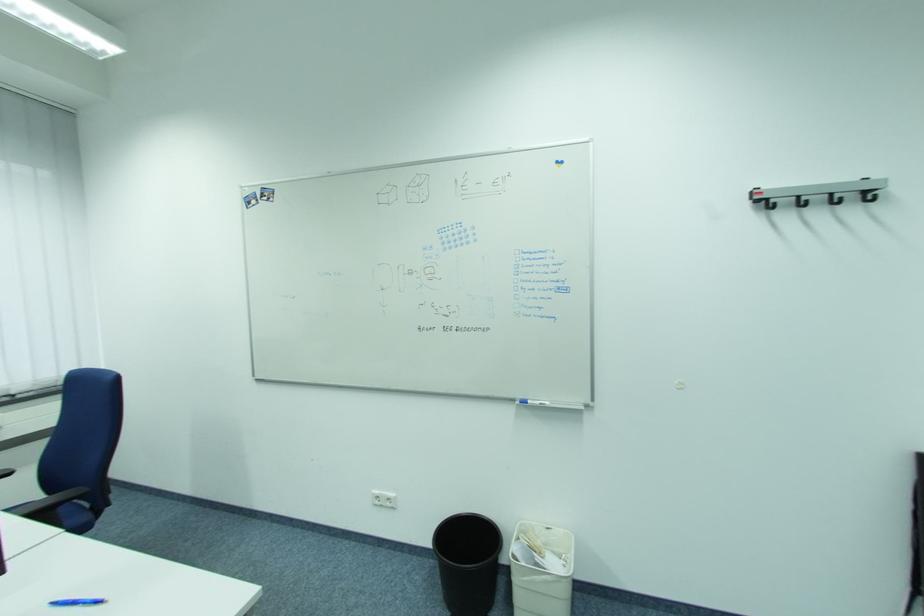
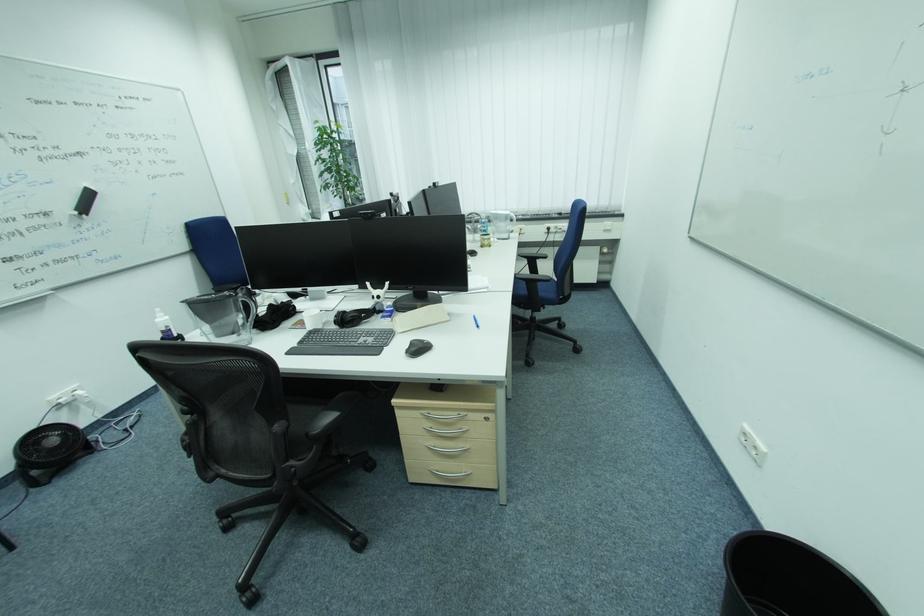
Where in the second image is the point corresponding to (x=414, y=575) from the first image?

(733, 537)